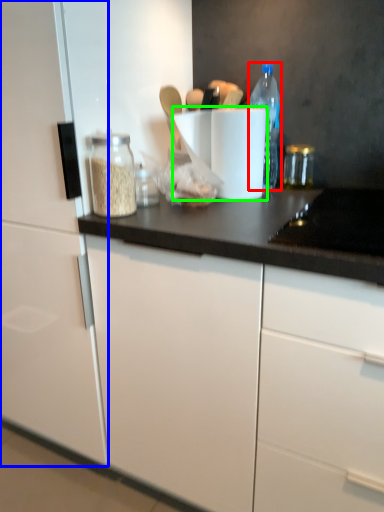
Question: Which object is positioned farthest from bottle (highlighted by a red box)? Select from cabinetry (highlighted by a blue box) and paper towel (highlighted by a green box).

Choices:
 (A) cabinetry
 (B) paper towel

Answer: (A)